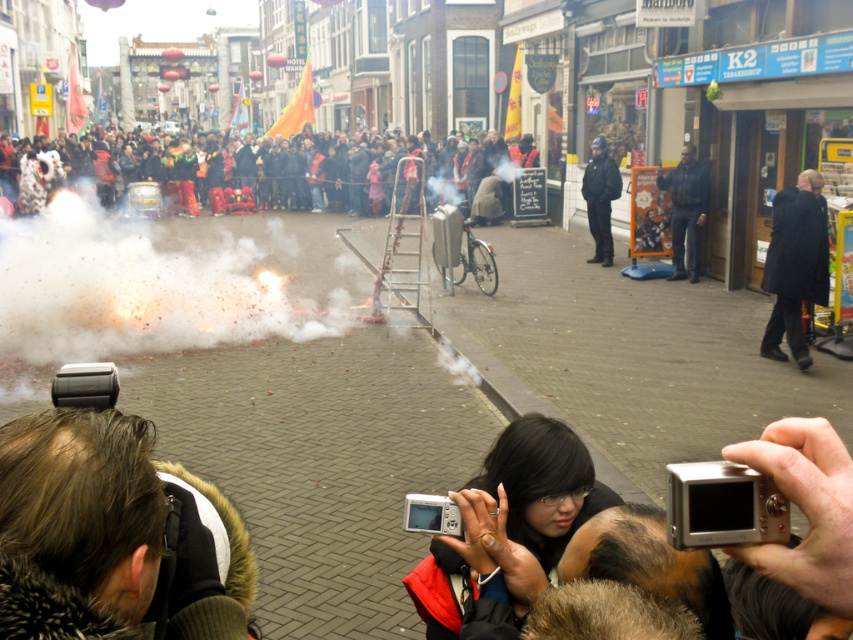
Can you confirm if dark blue jacket at center is positioned above dark clothing crowd at center?

Incorrect, dark blue jacket at center is not positioned above dark clothing crowd at center.

This screenshot has width=853, height=640. Describe the element at coordinates (686, 209) in the screenshot. I see `dark blue jacket at center` at that location.

Identify the location of dark blue jacket at center. (686, 209).

Which is more to the left, dark wool coat at right or black uniformed officer at center?

black uniformed officer at center

Between point (799, 301) and point (587, 164), which one is positioned behind?

The point (587, 164) is more distant.

Which is in front, point (799, 273) or point (608, 198)?

Point (799, 273)

You are a GUI agent. You are given a task and a screenshot of the screen. Output one action in this format:
    pyautogui.click(x=<x>, y=<y>)
    Task: Click on the dark wool coat at right
    The image size is (853, 640).
    Given the screenshot: What is the action you would take?
    pyautogui.click(x=795, y=264)

Does dark blue jacket at center appear on the left side of black uniformed officer at center?

No, dark blue jacket at center is not to the left of black uniformed officer at center.

Is dark blue jacket at center below black uniformed officer at center?

Indeed, dark blue jacket at center is positioned under black uniformed officer at center.

Is point (680, 177) less distant than point (610, 164)?

Yes, point (680, 177) is closer to viewer.

In order to click on dark blue jacket at center in this screenshot , I will do `click(686, 209)`.